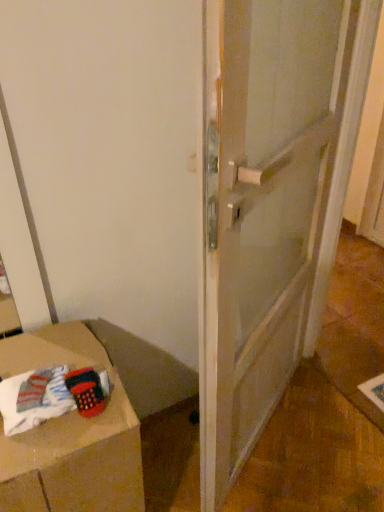
Identify the location of free space behind white soft fabric at lower left. Image resolution: width=384 pixels, height=512 pixels. (54, 353).